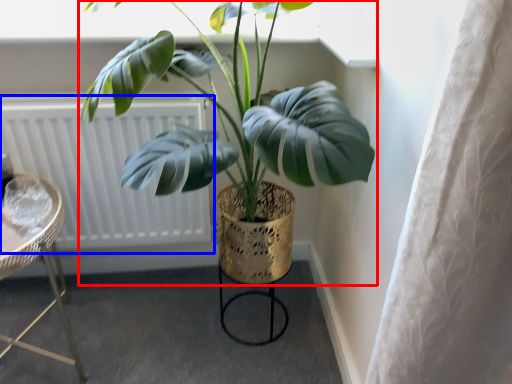
Question: Which point is closer to the camera, houseplant (highlighted by a red box) or radiator (highlighted by a blue box)?

Choices:
 (A) houseplant
 (B) radiator

Answer: (A)